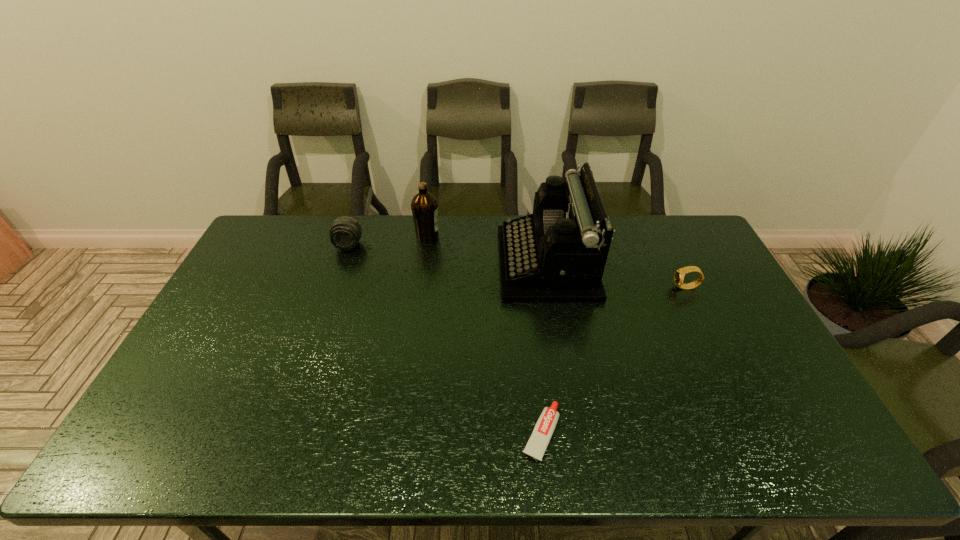
The width and height of the screenshot is (960, 540). In order to click on vacant area in the image that satisfies the following two spatial constraints: 1. on the label of the second tallest object; 2. at the front element of the third shortest object in this screenshot , I will do `click(426, 245)`.

At what (x,y) coordinates should I click in order to perform the action: click on vacant space that satisfies the following two spatial constraints: 1. on the label of the second tallest object; 2. on the back side of the nearest object. Please return your answer as a coordinate pair (x, y). This screenshot has width=960, height=540. Looking at the image, I should click on (399, 433).

At what (x,y) coordinates should I click in order to perform the action: click on vacant space that satisfies the following two spatial constraints: 1. at the front element of the toothpaste; 2. on the left side of the third tallest object. Please return your answer as a coordinate pair (x, y). The width and height of the screenshot is (960, 540). Looking at the image, I should click on (283, 433).

Find the location of a particular element. free region that satisfies the following two spatial constraints: 1. on the label of the fourth shortest object; 2. on the right side of the toothpaste is located at coordinates (399, 433).